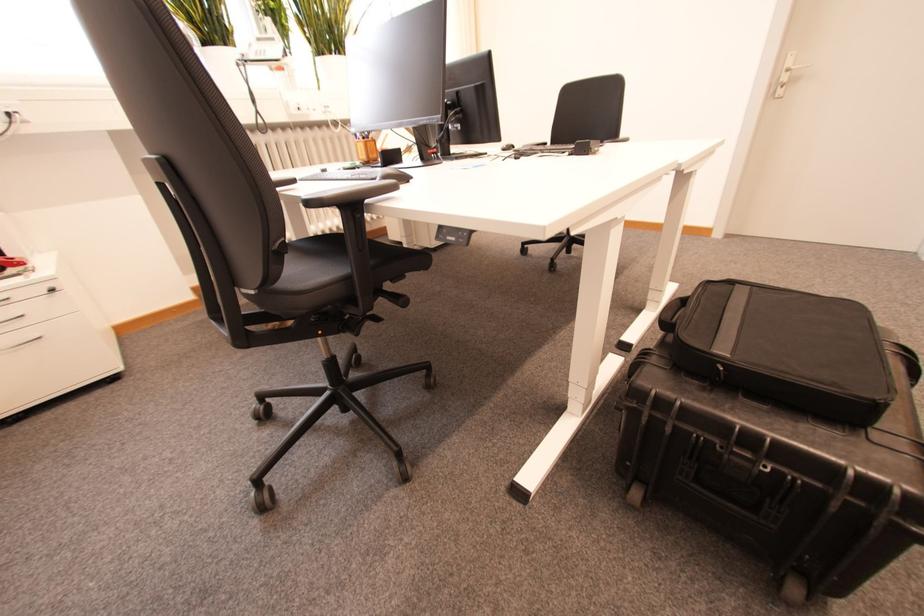
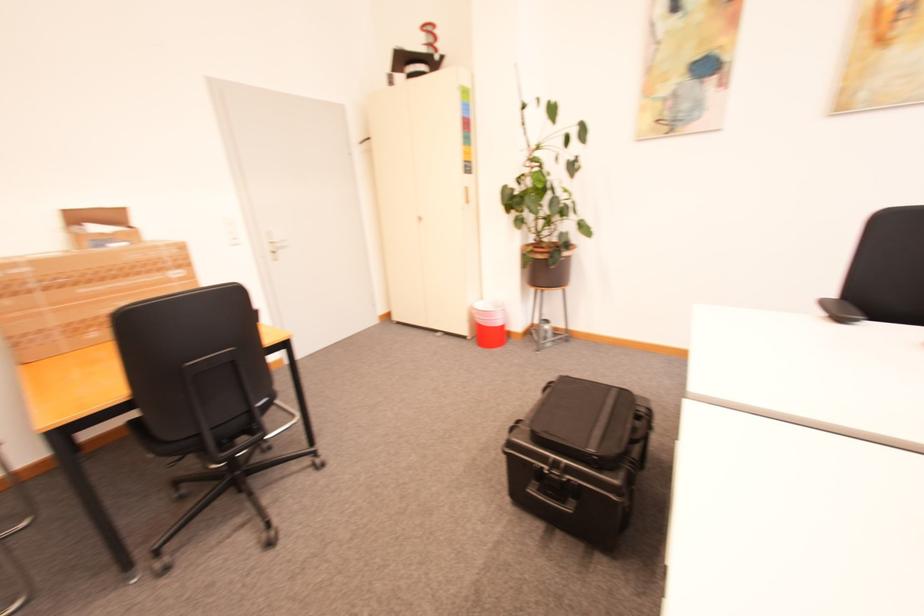
Question: I am providing you with two images of the same scene from different viewpoints. Please identify which objects are invisible in image2.

Choices:
 (A) chair sitting surface
 (B) silver door handle
 (C) desk height control
 (D) luggage carry handle

Answer: (C)